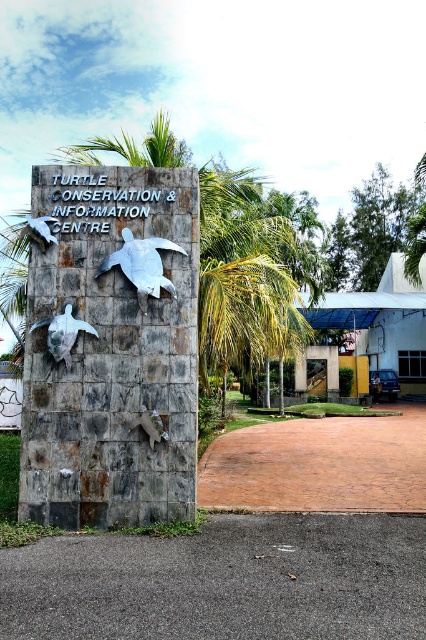
Question: Is rusty stone turtles at center below matte silver turtle at lower left?

Choices:
 (A) no
 (B) yes

Answer: (A)

Question: Is the position of rusty stone turtles at center less distant than that of metallic turtle at center?

Choices:
 (A) yes
 (B) no

Answer: (A)

Question: Can you confirm if metallic turtle at center is bigger than matte silver turtle at lower left?

Choices:
 (A) yes
 (B) no

Answer: (A)

Question: Estimate the real-world distances between objects in this image. Which object is farther from the metallic turtle at center?

Choices:
 (A) rusty stone turtles at center
 (B) matte silver turtle at lower left

Answer: (B)

Question: Which of the following is the closest to the observer?

Choices:
 (A) (85, 332)
 (B) (120, 266)

Answer: (A)

Question: Which point appears farthest from the camera in this image?

Choices:
 (A) (161, 202)
 (B) (57, 337)

Answer: (A)